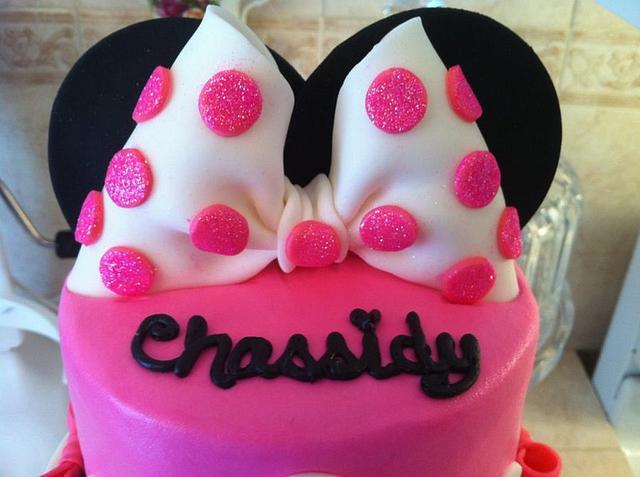
Identify the location of counter top. (573, 417).